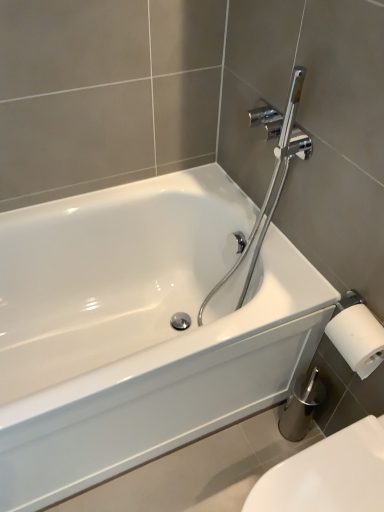
In order to face white glossy bathtub at center, should I rotate leftwards or rightwards?

Rotate left and turn 9.098 degrees.

You are a GUI agent. You are given a task and a screenshot of the screen. Output one action in this format:
    pyautogui.click(x=<x>, y=<y>)
    Task: Click on the white glossy toilet at lower right
    This screenshot has width=384, height=512.
    Given the screenshot: What is the action you would take?
    pyautogui.click(x=328, y=474)

Are chrome/polished metal showerhead at upper right and white glossy toilet at lower right making contact?

No.

Can you confirm if chrome/polished metal showerhead at upper right is positioned to the right of white glossy toilet at lower right?

No.

Considering their positions, is chrome/polished metal showerhead at upper right located in front of or behind white glossy toilet at lower right?

Clearly, chrome/polished metal showerhead at upper right is behind white glossy toilet at lower right.

From a real-world perspective, is chrome/polished metal showerhead at upper right located beneath white glossy toilet at lower right?

No, from a real-world perspective, chrome/polished metal showerhead at upper right is not below white glossy toilet at lower right.

In the scene shown: Considering the sizes of objects white glossy bathtub at center and white glossy toilet at lower right in the image provided, who is smaller, white glossy bathtub at center or white glossy toilet at lower right?

white glossy toilet at lower right is smaller.

Considering the positions of points (212, 345) and (312, 461), is point (212, 345) closer to camera compared to point (312, 461)?

No, it is not.

From a real-world perspective, is white glossy bathtub at center physically above white glossy toilet at lower right?

Yes, from a real-world perspective, white glossy bathtub at center is on top of white glossy toilet at lower right.

Could you tell me if white glossy bathtub at center is turned towards white glossy toilet at lower right?

Yes, white glossy bathtub at center faces towards white glossy toilet at lower right.

Can you tell me how much white glossy bathtub at center and chrome/polished metal showerhead at upper right differ in facing direction?

There is a 89.8-degree angle between the facing directions of white glossy bathtub at center and chrome/polished metal showerhead at upper right.

This screenshot has height=512, width=384. In order to click on plumbing fixture on the right of the white glossy bathtub at center in this screenshot , I will do `click(273, 173)`.

Is white glossy bathtub at center surrounding chrome/polished metal showerhead at upper right?

Yes, white glossy bathtub at center contains chrome/polished metal showerhead at upper right.

Is white glossy toilet at lower right positioned with its back to chrome/polished metal showerhead at upper right?

white glossy toilet at lower right is not turned away from chrome/polished metal showerhead at upper right.

From a real-world perspective, is white glossy toilet at lower right positioned above or below chrome/polished metal showerhead at upper right?

white glossy toilet at lower right is situated lower than chrome/polished metal showerhead at upper right in the real world.

Who is bigger, white glossy toilet at lower right or chrome/polished metal showerhead at upper right?

With larger size is chrome/polished metal showerhead at upper right.

Who is smaller, white glossy toilet at lower right or white glossy bathtub at center?

white glossy toilet at lower right.

From the image's perspective, does white glossy toilet at lower right appear lower than white glossy bathtub at center?

Yes.

How different are the orientations of white glossy toilet at lower right and white glossy bathtub at center in degrees?

There is a 89.9-degree angle between the facing directions of white glossy toilet at lower right and white glossy bathtub at center.

Identify the location of bathtub located on the left of white glossy toilet at lower right. Image resolution: width=384 pixels, height=512 pixels. (140, 329).

Does chrome/polished metal showerhead at upper right lie in front of white glossy bathtub at center?

No, the depth of chrome/polished metal showerhead at upper right is greater than that of white glossy bathtub at center.

In terms of size, does chrome/polished metal showerhead at upper right appear bigger or smaller than white glossy bathtub at center?

Clearly, chrome/polished metal showerhead at upper right is smaller in size than white glossy bathtub at center.

Which of these two, chrome/polished metal showerhead at upper right or white glossy bathtub at center, stands taller?

Standing taller between the two is chrome/polished metal showerhead at upper right.

Is chrome/polished metal showerhead at upper right looking in the opposite direction of white glossy bathtub at center?

chrome/polished metal showerhead at upper right is not turned away from white glossy bathtub at center.

Find the location of `plumbing fixture lying behind the white glossy toilet at lower right`. plumbing fixture lying behind the white glossy toilet at lower right is located at coordinates (273, 173).

Find the location of `toilet below the white glossy bathtub at center (from a real-world perspective)`. toilet below the white glossy bathtub at center (from a real-world perspective) is located at coordinates (328, 474).

Estimate the real-world distances between objects in this image. Which object is closer to white glossy toilet at lower right, chrome/polished metal showerhead at upper right or white glossy bathtub at center?

white glossy bathtub at center.

Which object lies further to the anchor point chrome/polished metal showerhead at upper right, white glossy bathtub at center or white glossy toilet at lower right?

white glossy toilet at lower right.

When comparing their distances from white glossy toilet at lower right, does white glossy bathtub at center or chrome/polished metal showerhead at upper right seem closer?

white glossy bathtub at center.

Estimate the real-world distances between objects in this image. Which object is closer to white glossy bathtub at center, white glossy toilet at lower right or chrome/polished metal showerhead at upper right?

chrome/polished metal showerhead at upper right is positioned closer to the anchor white glossy bathtub at center.

Estimate the real-world distances between objects in this image. Which object is closer to chrome/polished metal showerhead at upper right, white glossy toilet at lower right or white glossy bathtub at center?

Among the two, white glossy bathtub at center is located nearer to chrome/polished metal showerhead at upper right.

From the image, which object appears to be farther from white glossy bathtub at center, chrome/polished metal showerhead at upper right or white glossy toilet at lower right?

white glossy toilet at lower right is positioned further to the anchor white glossy bathtub at center.

At what (x,y) coordinates should I click in order to perform the action: click on bathtub between chrome/polished metal showerhead at upper right and white glossy toilet at lower right in the vertical direction. Please return your answer as a coordinate pair (x, y). Image resolution: width=384 pixels, height=512 pixels. Looking at the image, I should click on (140, 329).